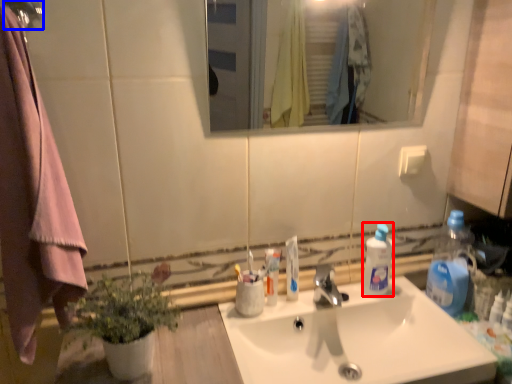
Question: Which of the following is the closest to the observer, bottle (highlighted by a red box) or shower (highlighted by a blue box)?

Choices:
 (A) bottle
 (B) shower

Answer: (B)